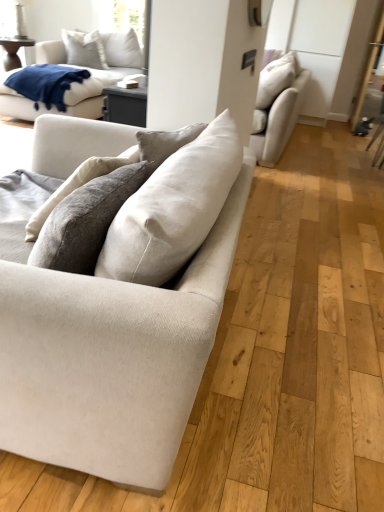
Question: In terms of width, does beige fabric couch at upper right, which is the 2th studio couch from left to right, look wider or thinner when compared to white cotton pillow at upper left?

Choices:
 (A) thin
 (B) wide

Answer: (B)

Question: From the image's perspective, relative to white cotton pillow at upper left, is beige fabric couch at upper right, the 2th studio couch viewed from the front, above or below?

Choices:
 (A) above
 (B) below

Answer: (B)

Question: Which object is positioned farthest from the blue soft fabric blanket at upper left?

Choices:
 (A) beige fabric couch at upper right, placed as the first studio couch when sorted from right to left
 (B) beige fabric couch at center, placed as the first studio couch when sorted from front to back
 (C) white matte cabinet at upper right
 (D) white cotton pillow at upper left

Answer: (B)

Question: Which object is positioned farthest from the white cotton pillow at upper left?

Choices:
 (A) beige fabric couch at center, placed as the first studio couch when sorted from front to back
 (B) blue soft fabric blanket at upper left
 (C) white matte cabinet at upper right
 (D) beige fabric couch at upper right, the 2th studio couch when ordered from bottom to top

Answer: (A)